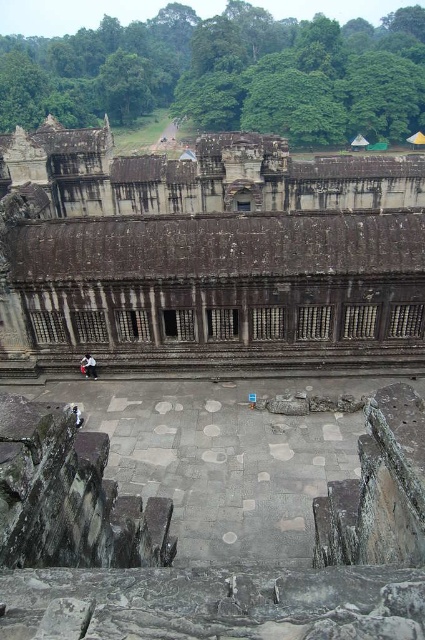
Looking at this image, between weathered stone ruins at center and white cotton shirt at center, which one appears on the left side from the viewer's perspective?

white cotton shirt at center

Which is more to the right, weathered stone ruins at center or white cotton shirt at center?

From the viewer's perspective, weathered stone ruins at center appears more on the right side.

Which is in front, point (258, 282) or point (82, 364)?

Point (258, 282) is in front.

Where is `weathered stone ruins at center`? weathered stone ruins at center is located at coordinates (212, 253).